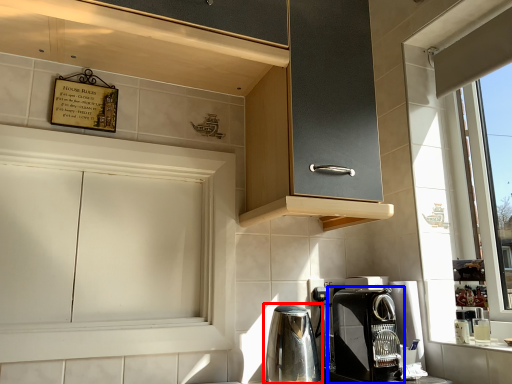
Question: Which point is further to the camera, home appliance (highlighted by a red box) or coffee maker (highlighted by a blue box)?

Choices:
 (A) home appliance
 (B) coffee maker

Answer: (A)